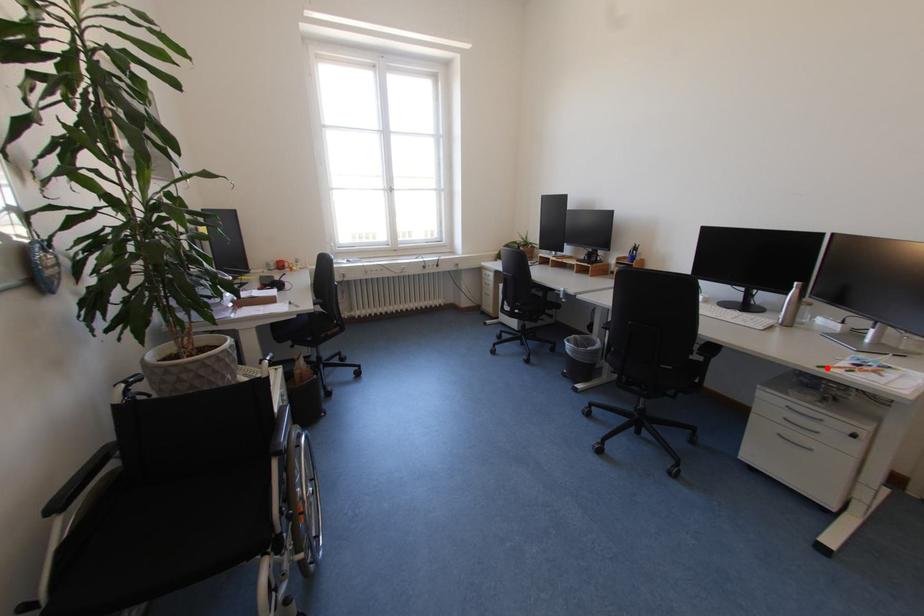
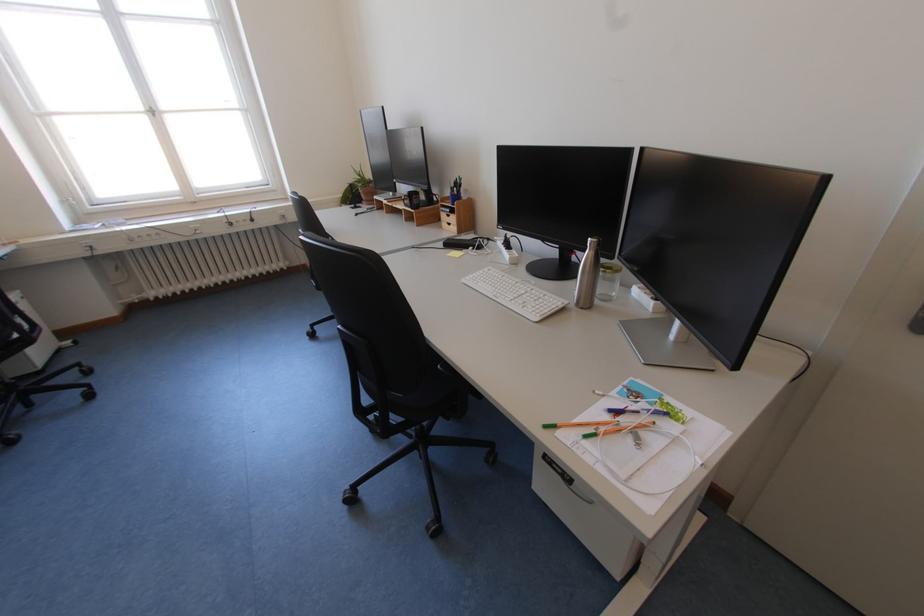
The point at the highlighted location is marked in the first image. Where is the corresponding point in the second image?

(553, 428)